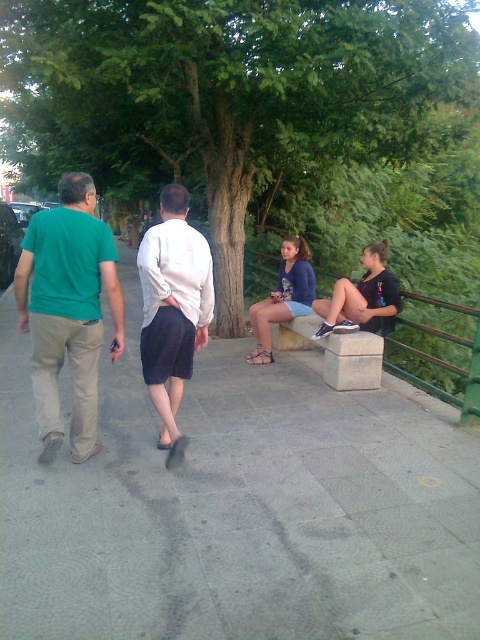
You are standing at the camera position and want to determine which of the two points, point (69, 310) or point (268, 353), is nearer to you. Based on the scene, which point is closer?

Point (69, 310) is closer to the camera than point (268, 353).

You are standing at the camera position and want to greet both people wearing the green matte shirt at left and the white matte shirt at center. Which one should you approach first to reach them more quickly?

The green matte shirt at left is closer to the viewer than the white matte shirt at center, so you should approach the green matte shirt at left first to reach them more quickly.